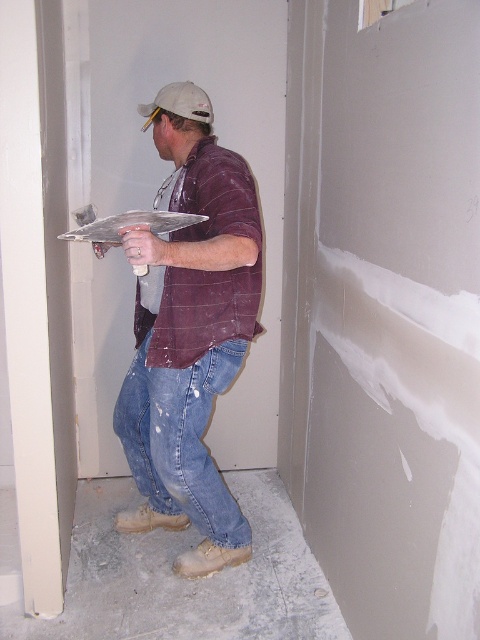
In the scene shown: You are standing in the room where the plastering work is being done. You notice two points marked on the wall. The first point is at coordinates point [237,557] and the second is at point [60,392]. If you are facing the wall, which point is closer to you?

Point [60,392] is closer to you because it is in front of point [237,557].

You are a safety inspector checking the workspace. You notice a point at coordinate (165, 490) in the image. According to safety guidelines, all work areas must be within 7 feet of the inspector. Is this point within the required distance?

The distance between point (165, 490) and the camera is 8.15 feet, which exceeds the 7 feet requirement. Therefore, this point is outside the allowed distance range.

You are a construction inspector checking the plastering work in the room. You notice a point at coordinates (190,342). What object is located at this point?

The point at coordinates (190,342) indicates the matte brown shirt at center.